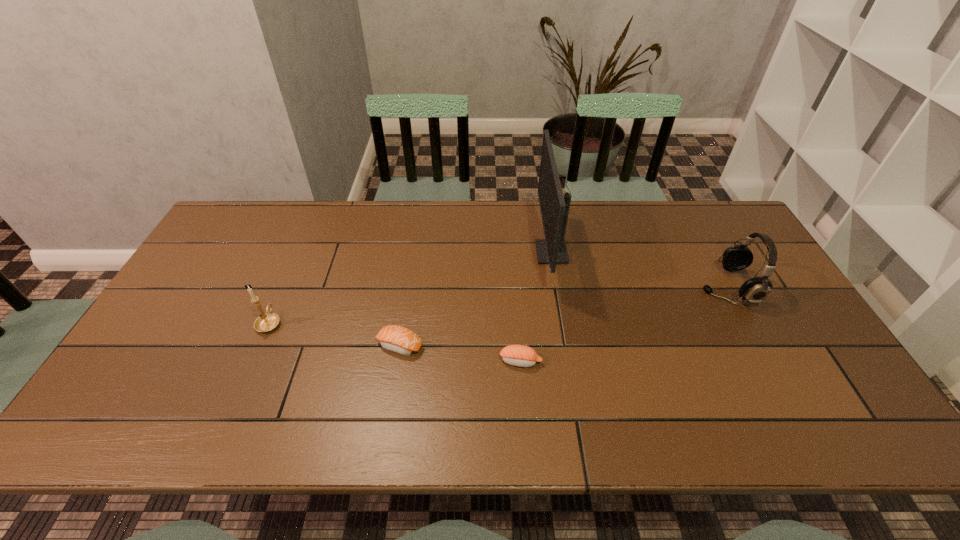
Find the location of a particular element. Image resolution: width=960 pixels, height=540 pixels. object that is positioned at the right edge is located at coordinates (755, 290).

The image size is (960, 540). I want to click on vacant area at the far edge, so [434, 225].

Locate an element on the screen. Image resolution: width=960 pixels, height=540 pixels. blank space at the left edge of the desktop is located at coordinates (163, 358).

Where is `vacant space at the right edge of the desktop`? The width and height of the screenshot is (960, 540). vacant space at the right edge of the desktop is located at coordinates (796, 399).

This screenshot has width=960, height=540. I want to click on free space at the far left corner of the desktop, so click(x=257, y=231).

Locate an element on the screen. This screenshot has height=540, width=960. free space at the near left corner of the desktop is located at coordinates click(x=140, y=433).

Identify the location of vacant area that lies between the tallest object and the second object from left to right. Image resolution: width=960 pixels, height=540 pixels. (475, 299).

Find the location of a particular element. vacant space that is in between the left sushi and the candle holder is located at coordinates (335, 334).

The height and width of the screenshot is (540, 960). In order to click on free space between the left sushi and the third object from left to right in this screenshot , I will do `click(461, 353)`.

Locate an element on the screen. free spot between the candle holder and the left sushi is located at coordinates (335, 334).